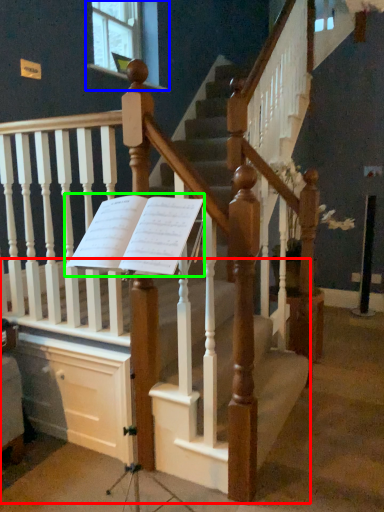
Question: Which object is positioned farthest from stairs (highlighted by a red box)? Select from window (highlighted by a blue box) and sheet music (highlighted by a green box).

Choices:
 (A) window
 (B) sheet music

Answer: (A)